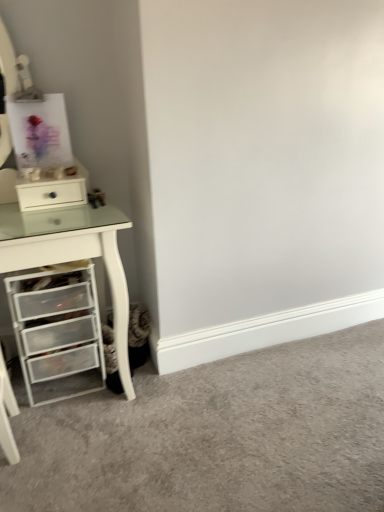
Identify the location of white plastic drawer unit at left. The width and height of the screenshot is (384, 512). (80, 259).

Identify the location of white plastic drawers at lower left. (56, 326).

Between white glossy drawer at upper left and white plastic drawer unit at left, which one is positioned behind?

white glossy drawer at upper left is further from the camera.

Which of these two, white glossy drawer at upper left or white plastic drawer unit at left, is thinner?

With smaller width is white glossy drawer at upper left.

Between white glossy drawer at upper left and white plastic drawer unit at left, which one has less height?

Standing shorter between the two is white glossy drawer at upper left.

Is white plastic drawer unit at left completely or partially inside white glossy drawer at upper left?

Definitely not — white plastic drawer unit at left is not inside white glossy drawer at upper left.

Between white plastic drawer unit at left and white plastic drawers at lower left, which one has less height?

With less height is white plastic drawers at lower left.

What's the angular difference between white plastic drawer unit at left and white plastic drawers at lower left's facing directions?

They differ by 2 degrees in their facing directions.

Is white plastic drawer unit at left wider than white plastic drawers at lower left?

Yes.

Is the position of white plastic drawers at lower left more distant than that of white glossy drawer at upper left?

No, it is not.

Is white plastic drawers at lower left aimed at white glossy drawer at upper left?

No, white plastic drawers at lower left does not turn towards white glossy drawer at upper left.

You are a GUI agent. You are given a task and a screenshot of the screen. Output one action in this format:
    pyautogui.click(x=<x>, y=<y>)
    Task: Click on the chest of drawers below the white glossy drawer at upper left (from the image's perspective)
    
    Given the screenshot: What is the action you would take?
    [56, 326]

Looking at this image, which is correct: white plastic drawers at lower left is inside white glossy drawer at upper left, or outside of it?

white plastic drawers at lower left is spatially situated outside white glossy drawer at upper left.

Between point (30, 308) and point (38, 255), which one is positioned behind?

Positioned behind is point (30, 308).

Considering the sizes of objects white plastic drawers at lower left and white plastic drawer unit at left in the image provided, who is bigger, white plastic drawers at lower left or white plastic drawer unit at left?

white plastic drawer unit at left.

From the picture: Is white plastic drawers at lower left far from white plastic drawer unit at left?

They are positioned close to each other.

Is white plastic drawer unit at left spatially inside white glossy drawer at upper left, or outside of it?

white plastic drawer unit at left cannot be found inside white glossy drawer at upper left.

Is point (104, 259) closer to camera compared to point (25, 198)?

Yes, it is in front of point (25, 198).

Does white plastic drawer unit at left have a smaller size compared to white glossy drawer at upper left?

No.

From a real-world perspective, who is located lower, white plastic drawer unit at left or white glossy drawer at upper left?

white plastic drawer unit at left.

Is white glossy drawer at upper left beside white plastic drawers at lower left?

No.

From a real-world perspective, which is physically above, white glossy drawer at upper left or white plastic drawers at lower left?

From a 3D spatial view, white glossy drawer at upper left is above.

Which object is thinner, white glossy drawer at upper left or white plastic drawers at lower left?

white glossy drawer at upper left is thinner.

From the picture: Between white glossy drawer at upper left and white plastic drawers at lower left, which one appears on the left side from the viewer's perspective?

white plastic drawers at lower left.

This screenshot has height=512, width=384. I want to click on file cabinet behind the white plastic drawer unit at left, so click(x=53, y=191).

What are the coordinates of `computer desk above the white plastic drawers at lower left (from the image's perspective)` in the screenshot? It's located at (80, 259).

Based on the photo, looking at the image, which one is located closer to white glossy drawer at upper left, white plastic drawers at lower left or white plastic drawer unit at left?

white plastic drawer unit at left is closer to white glossy drawer at upper left.

Based on the photo, based on their spatial positions, is white plastic drawers at lower left or white glossy drawer at upper left further from white plastic drawer unit at left?

The object further to white plastic drawer unit at left is white glossy drawer at upper left.

Which object lies further to the anchor point white plastic drawers at lower left, white plastic drawer unit at left or white glossy drawer at upper left?

Among the two, white glossy drawer at upper left is located further to white plastic drawers at lower left.

Which object lies nearer to the anchor point white plastic drawer unit at left, white glossy drawer at upper left or white plastic drawers at lower left?

white plastic drawers at lower left is closer to white plastic drawer unit at left.

Looking at the image, which one is located further to white glossy drawer at upper left, white plastic drawer unit at left or white plastic drawers at lower left?

white plastic drawers at lower left.

Based on their spatial positions, is white glossy drawer at upper left or white plastic drawer unit at left closer to white plastic drawers at lower left?

white plastic drawer unit at left.

You are a GUI agent. You are given a task and a screenshot of the screen. Output one action in this format:
    pyautogui.click(x=<x>, y=<y>)
    Task: Click on the chest of drawers positioned between white plastic drawer unit at left and white glossy drawer at upper left from near to far
    Image resolution: width=384 pixels, height=512 pixels.
    Given the screenshot: What is the action you would take?
    pyautogui.click(x=56, y=326)